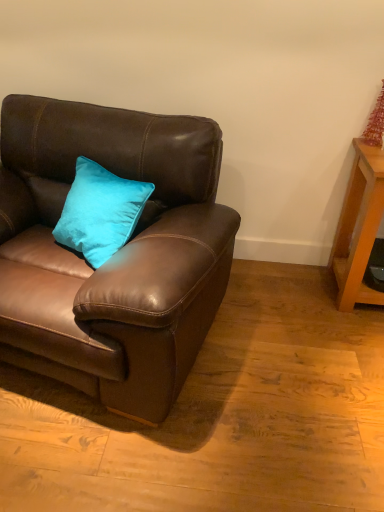
Question: Is brown leather couch at left in front of or behind wooden table at right in the image?

Choices:
 (A) behind
 (B) front

Answer: (B)

Question: Looking at their shapes, would you say brown leather couch at left is wider or thinner than wooden table at right?

Choices:
 (A) wide
 (B) thin

Answer: (A)

Question: In terms of height, does brown leather couch at left look taller or shorter compared to wooden table at right?

Choices:
 (A) tall
 (B) short

Answer: (A)

Question: Looking at their shapes, would you say wooden table at right is wider or thinner than brown leather couch at left?

Choices:
 (A) thin
 (B) wide

Answer: (A)

Question: Visually, is wooden table at right positioned to the left or to the right of brown leather couch at left?

Choices:
 (A) left
 (B) right

Answer: (B)

Question: From a real-world perspective, relative to brown leather couch at left, is wooden table at right vertically above or below?

Choices:
 (A) above
 (B) below

Answer: (B)

Question: From their relative heights in the image, would you say wooden table at right is taller or shorter than brown leather couch at left?

Choices:
 (A) tall
 (B) short

Answer: (B)